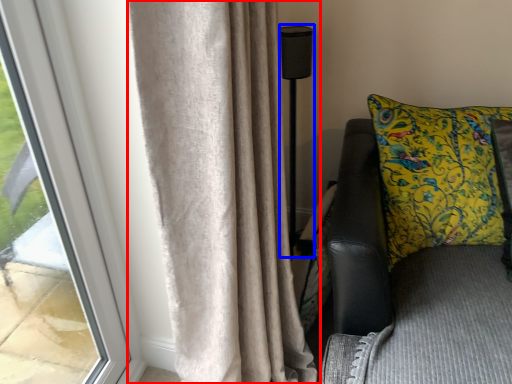
Question: Among these objects, which one is farthest to the camera, curtain (highlighted by a red box) or lamp (highlighted by a blue box)?

Choices:
 (A) curtain
 (B) lamp

Answer: (B)